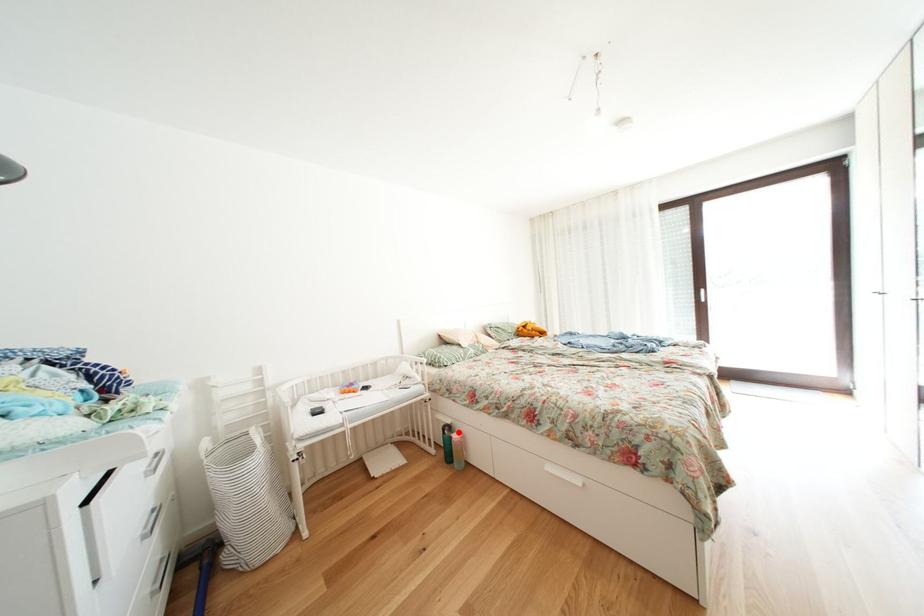
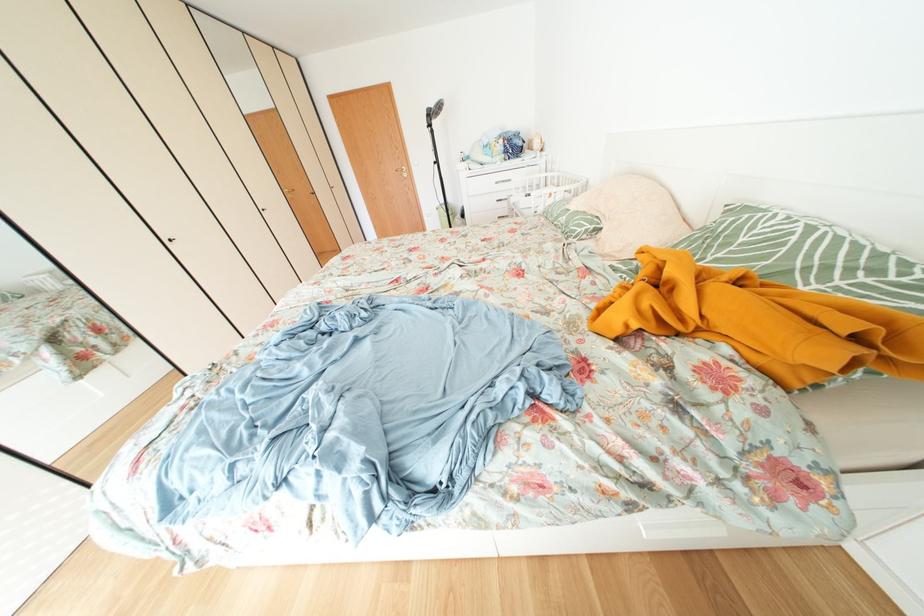
Question: I am providing you with two images of the same scene from different viewpoints. A red point is marked on the first image. Is the red point's position out of view in image 2?

Choices:
 (A) Yes
 (B) No

Answer: (A)